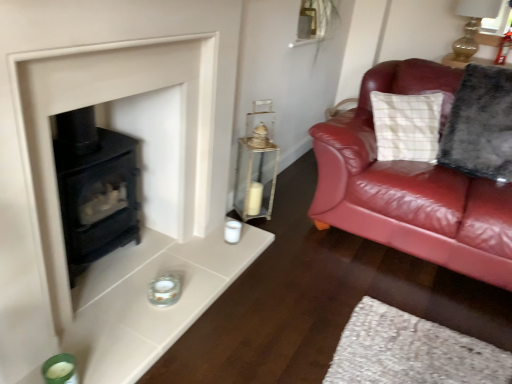
This screenshot has width=512, height=384. What are the coordinates of `vacant space to the right of clear glass lantern at center` in the screenshot? It's located at (281, 221).